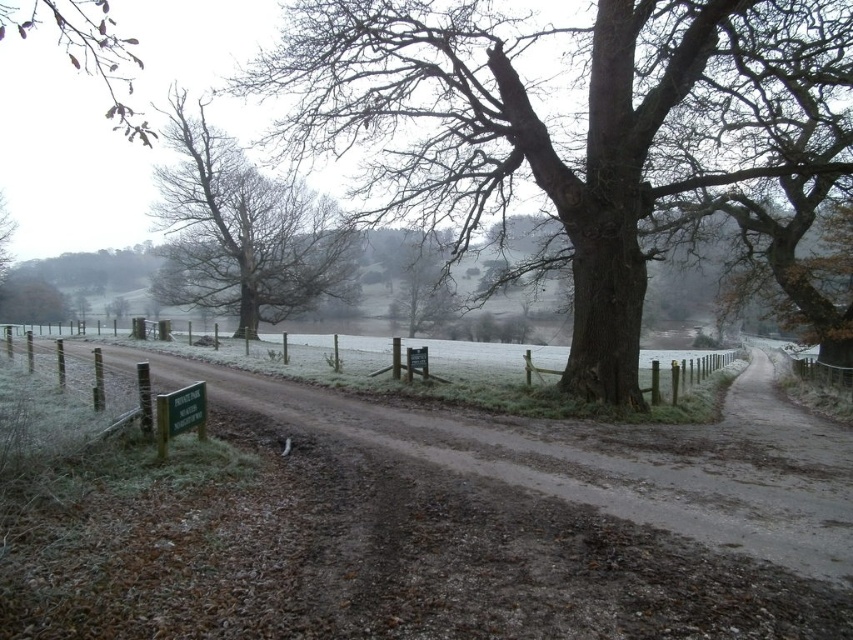
Does bare wood tree at upper left appear on the left side of wooden fence at center?

Correct, you'll find bare wood tree at upper left to the left of wooden fence at center.

Who is more distant from viewer, (296, 236) or (711, 355)?

Positioned behind is point (711, 355).

Where is `bare wood tree at upper left`? This screenshot has height=640, width=853. bare wood tree at upper left is located at coordinates (242, 230).

Who is positioned more to the left, brown rough bark tree at center or bare wood tree at upper left?

From the viewer's perspective, bare wood tree at upper left appears more on the left side.

Does brown rough bark tree at center have a larger size compared to bare wood tree at upper left?

No, brown rough bark tree at center is not bigger than bare wood tree at upper left.

Is point (613, 380) positioned before point (245, 186)?

Yes, point (613, 380) is closer to viewer.

Locate an element on the screen. This screenshot has width=853, height=640. brown rough bark tree at center is located at coordinates [x=566, y=124].

Does brown dirt track at center appear on the left side of wooden fence at center?

No, brown dirt track at center is not to the left of wooden fence at center.

Is brown dirt track at center positioned behind wooden fence at center?

No, brown dirt track at center is closer to the viewer.

Does point (592, 609) come closer to viewer compared to point (360, 356)?

That is True.

Image resolution: width=853 pixels, height=640 pixels. Identify the location of brown dirt track at center. (418, 524).